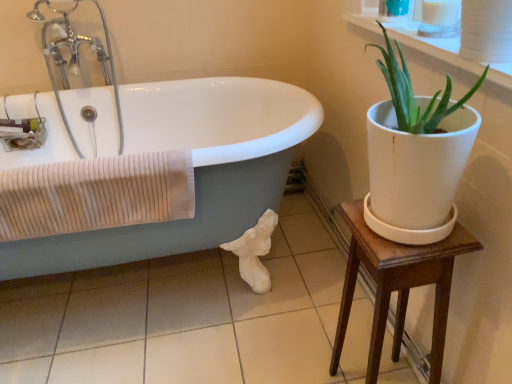
Question: Is white glossy bathtub at left outside of white glossy tile at lower center?

Choices:
 (A) yes
 (B) no

Answer: (A)

Question: Is white glossy tile at lower center completely or partially inside white glossy bathtub at left?

Choices:
 (A) yes
 (B) no

Answer: (B)

Question: Is white glossy bathtub at left positioned before white glossy tile at lower center?

Choices:
 (A) yes
 (B) no

Answer: (A)

Question: Does white glossy bathtub at left have a lesser width compared to white glossy tile at lower center?

Choices:
 (A) no
 (B) yes

Answer: (B)

Question: Is the surface of white glossy bathtub at left in direct contact with white glossy tile at lower center?

Choices:
 (A) yes
 (B) no

Answer: (B)

Question: Considering the positions of point (159, 163) and point (373, 11), is point (159, 163) closer or farther from the camera than point (373, 11)?

Choices:
 (A) farther
 (B) closer

Answer: (B)

Question: In the image, is beige ribbed towel at left positioned in front of or behind white ceramic plant at upper right?

Choices:
 (A) behind
 (B) front

Answer: (A)

Question: From a real-world perspective, is beige ribbed towel at left positioned above or below white ceramic plant at upper right?

Choices:
 (A) below
 (B) above

Answer: (A)

Question: Is beige ribbed towel at left taller or shorter than white ceramic plant at upper right?

Choices:
 (A) tall
 (B) short

Answer: (A)

Question: In terms of height, does wooden table at right look taller or shorter compared to white ceramic plant at upper right?

Choices:
 (A) tall
 (B) short

Answer: (A)

Question: Considering the positions of wooden table at right and white ceramic plant at upper right in the image, is wooden table at right wider or thinner than white ceramic plant at upper right?

Choices:
 (A) wide
 (B) thin

Answer: (A)

Question: From the image's perspective, relative to white ceramic plant at upper right, is wooden table at right above or below?

Choices:
 (A) below
 (B) above

Answer: (A)

Question: Considering the positions of point (439, 364) and point (461, 66), is point (439, 364) closer or farther from the camera than point (461, 66)?

Choices:
 (A) closer
 (B) farther

Answer: (B)

Question: In the image, is white glossy bathtub at left on the left side or the right side of wooden table at right?

Choices:
 (A) right
 (B) left

Answer: (B)

Question: From a real-world perspective, relative to wooden table at right, is white glossy bathtub at left vertically above or below?

Choices:
 (A) below
 (B) above

Answer: (B)